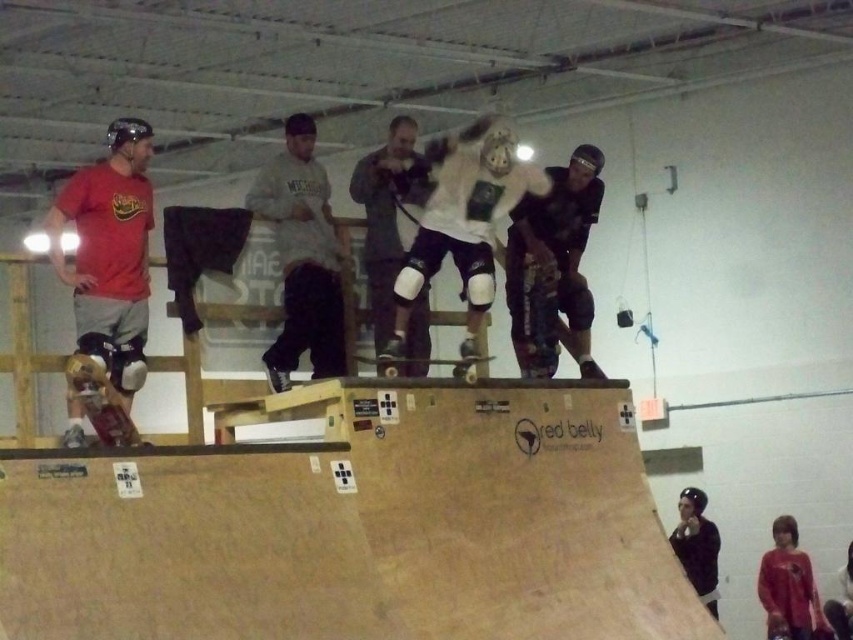
Question: Can you confirm if white matte helmet at center is positioned to the right of wooden skateboard at center?

Choices:
 (A) no
 (B) yes

Answer: (A)

Question: Is white matte knee pads at center thinner than wooden textured skateboard at center?

Choices:
 (A) yes
 (B) no

Answer: (B)

Question: Observing the image, what is the correct spatial positioning of white matte helmet at center in reference to camouflage pants at upper center?

Choices:
 (A) below
 (B) above

Answer: (B)

Question: Which object is closer to the camera taking this photo?

Choices:
 (A) dark gray sweatshirt at center
 (B) matte red t-shirt at left
 (C) wooden skateboard at center

Answer: (B)

Question: Which object is farther from the camera taking this photo?

Choices:
 (A) wooden skateboard at center
 (B) camouflage pants at upper center
 (C) matte red t-shirt at left
 (D) wooden textured skateboard at center

Answer: (D)

Question: Estimate the real-world distances between objects in this image. Which object is closer to the white matte knee pads at center?

Choices:
 (A) white matte helmet at center
 (B) dark gray sweatshirt at center
 (C) wooden skateboard at center
 (D) wooden skateboard at lower left

Answer: (A)